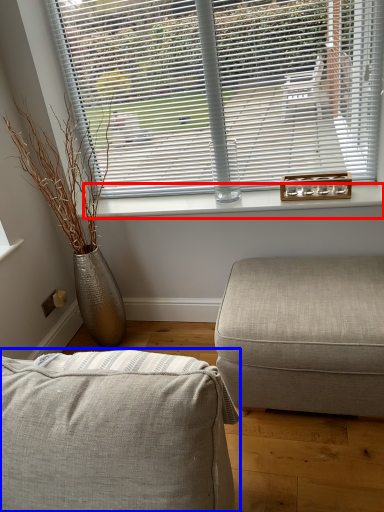
Question: Which object is further to the camera taking this photo, window sill (highlighted by a red box) or studio couch (highlighted by a blue box)?

Choices:
 (A) window sill
 (B) studio couch

Answer: (A)